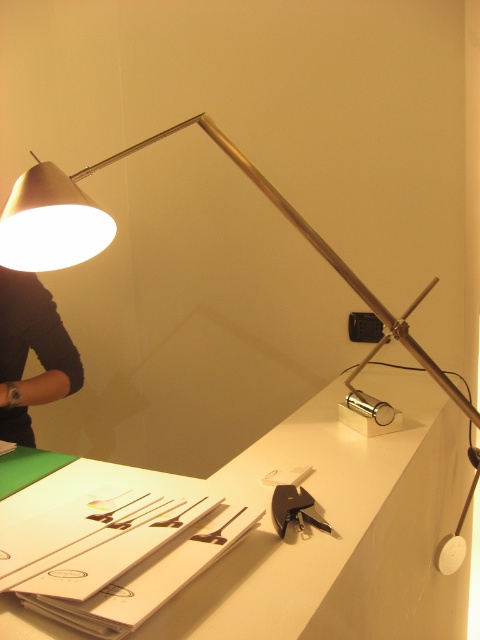
Question: Considering the relative positions of white glossy table at center and matte silver lamp at upper left in the image provided, where is white glossy table at center located with respect to matte silver lamp at upper left?

Choices:
 (A) left
 (B) right

Answer: (B)

Question: Which point is closer to the camera taking this photo?

Choices:
 (A) (48, 349)
 (B) (228, 140)

Answer: (B)

Question: Which object appears farthest from the camera in this image?

Choices:
 (A) black fabric arm at upper left
 (B) metallic keychain at lower center
 (C) white glossy table at center
 (D) matte silver lamp at upper left

Answer: (A)

Question: Is the position of black fabric arm at upper left less distant than that of metallic keychain at lower center?

Choices:
 (A) no
 (B) yes

Answer: (A)

Question: Considering the relative positions of matte silver lamp at upper left and metallic keychain at lower center in the image provided, where is matte silver lamp at upper left located with respect to metallic keychain at lower center?

Choices:
 (A) right
 (B) left

Answer: (B)

Question: Which of the following is the farthest from the observer?

Choices:
 (A) matte silver lamp at upper left
 (B) metallic keychain at lower center
 (C) black fabric arm at upper left

Answer: (C)